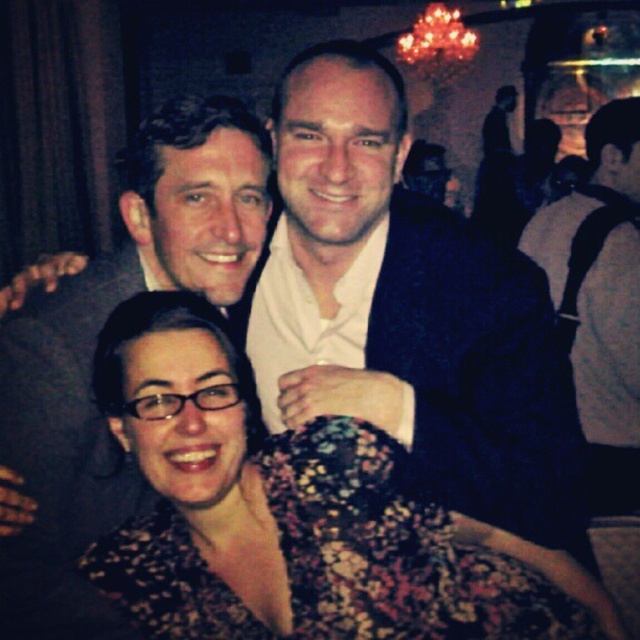
This screenshot has width=640, height=640. Describe the element at coordinates (292, 515) in the screenshot. I see `floral dress at center` at that location.

Is floral dress at center above white sweater at right?

Actually, floral dress at center is below white sweater at right.

Where is `floral dress at center`? The width and height of the screenshot is (640, 640). floral dress at center is located at coordinates (292, 515).

You are a GUI agent. You are given a task and a screenshot of the screen. Output one action in this format:
    pyautogui.click(x=<x>, y=<y>)
    Task: Click on the floral dress at center
    This screenshot has width=640, height=640.
    Given the screenshot: What is the action you would take?
    pyautogui.click(x=292, y=515)